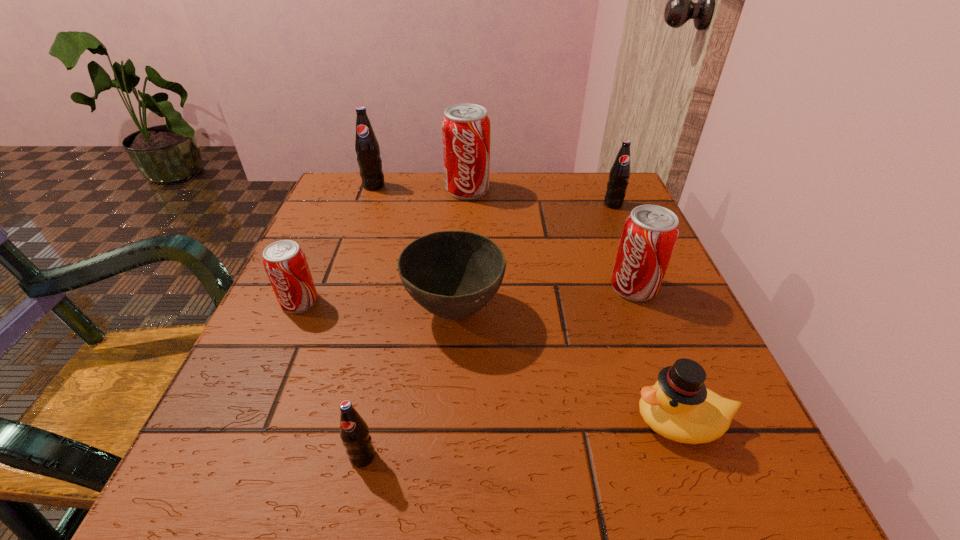
What are the coordinates of `the third pop from left to right` in the screenshot? It's located at (354, 432).

Where is `duck`? The height and width of the screenshot is (540, 960). duck is located at coordinates (679, 407).

Where is `vacant space located on the right of the farthest red soda can`? vacant space located on the right of the farthest red soda can is located at coordinates (579, 190).

I want to click on vacant position located on the front label of the biggest black pop, so click(359, 226).

I want to click on free spot located on the front label of the second smallest black pop, so click(643, 274).

At what (x,y) coordinates should I click in order to perform the action: click on vacant space located on the back of the rightmost red soda can. Please return your answer as a coordinate pair (x, y). This screenshot has height=540, width=960. Looking at the image, I should click on (595, 188).

Identify the location of free location located 0.080m on the left of the bowl. (360, 312).

In order to click on vacant space located on the front of the leftmost red soda can in this screenshot , I will do `click(246, 425)`.

Where is `free spot located 0.190m on the front-facing side of the duck`? free spot located 0.190m on the front-facing side of the duck is located at coordinates (493, 421).

Find the location of a particular element. This screenshot has height=540, width=960. free spot located 0.290m on the front-facing side of the duck is located at coordinates (421, 421).